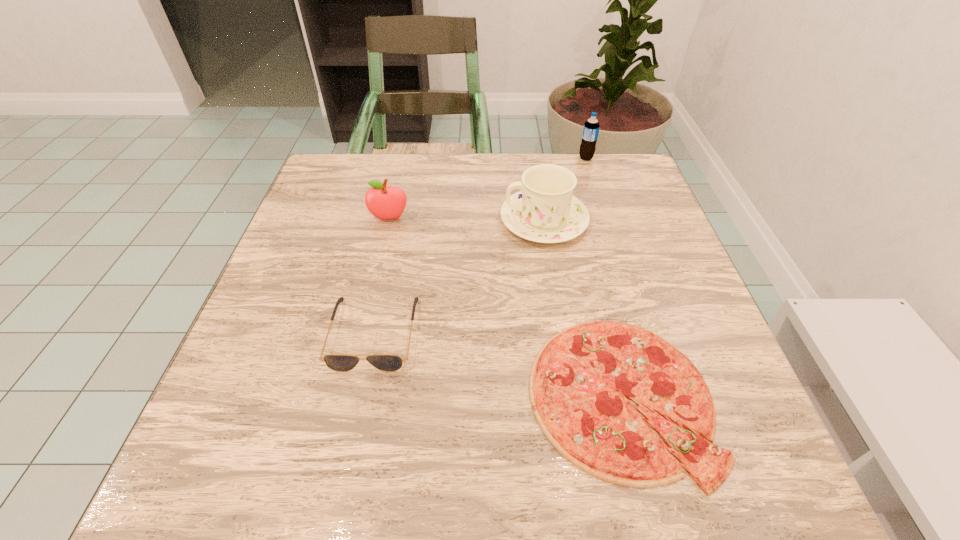
Identify the location of free region located on the front-facing side of the second shortest object. The height and width of the screenshot is (540, 960). 348,456.

You are a GUI agent. You are given a task and a screenshot of the screen. Output one action in this format:
    pyautogui.click(x=<x>, y=<y>)
    Task: Click on the vacant region located on the back of the pizza
    
    Given the screenshot: What is the action you would take?
    pyautogui.click(x=573, y=204)

In order to click on soda bottle that is at the far edge in this screenshot , I will do `click(591, 127)`.

You are a GUI agent. You are given a task and a screenshot of the screen. Output one action in this format:
    pyautogui.click(x=<x>, y=<y>)
    Task: Click on the chinaware at the far edge
    Image resolution: width=960 pixels, height=540 pixels.
    Given the screenshot: What is the action you would take?
    pyautogui.click(x=545, y=211)

I want to click on object that is at the near edge, so tap(579, 383).

Identify the location of apple that is at the left edge. (383, 202).

The width and height of the screenshot is (960, 540). I want to click on sunglasses that is at the left edge, so click(x=338, y=362).

Locate an element on the screen. This screenshot has height=540, width=960. soda bottle at the right edge is located at coordinates (591, 127).

Identify the location of pizza at the right edge. Image resolution: width=960 pixels, height=540 pixels. (579, 383).

Where is `object that is positioned at the far right corner`? This screenshot has width=960, height=540. object that is positioned at the far right corner is located at coordinates (591, 127).